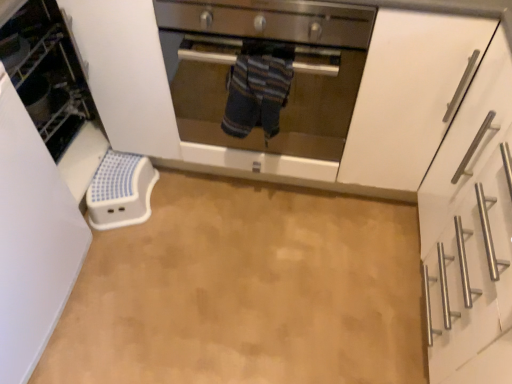
Question: Does white matte cabinet at right have a smaller size compared to stainless steel oven at center?

Choices:
 (A) no
 (B) yes

Answer: (A)

Question: Can you confirm if white matte cabinet at right is positioned to the right of stainless steel oven at center?

Choices:
 (A) yes
 (B) no

Answer: (A)

Question: From the image's perspective, is white matte cabinet at right located above stainless steel oven at center?

Choices:
 (A) yes
 (B) no

Answer: (B)

Question: Considering the relative sizes of white matte cabinet at right and stainless steel oven at center in the image provided, is white matte cabinet at right bigger than stainless steel oven at center?

Choices:
 (A) no
 (B) yes

Answer: (B)

Question: From the image's perspective, is white matte cabinet at right beneath stainless steel oven at center?

Choices:
 (A) no
 (B) yes

Answer: (B)

Question: From a real-world perspective, is stainless steel oven at center physically located above or below white plastic step stool at left?

Choices:
 (A) below
 (B) above

Answer: (B)

Question: Based on their sizes in the image, would you say stainless steel oven at center is bigger or smaller than white plastic step stool at left?

Choices:
 (A) small
 (B) big

Answer: (B)

Question: In terms of height, does stainless steel oven at center look taller or shorter compared to white plastic step stool at left?

Choices:
 (A) short
 (B) tall

Answer: (A)

Question: Relative to white plastic step stool at left, is stainless steel oven at center in front or behind?

Choices:
 (A) behind
 (B) front

Answer: (A)

Question: From a real-world perspective, is white matte cabinet at right physically located above or below stainless steel oven at center?

Choices:
 (A) above
 (B) below

Answer: (B)

Question: Is white matte cabinet at right situated inside stainless steel oven at center or outside?

Choices:
 (A) inside
 (B) outside

Answer: (B)

Question: Considering the positions of white matte cabinet at right and stainless steel oven at center in the image, is white matte cabinet at right wider or thinner than stainless steel oven at center?

Choices:
 (A) wide
 (B) thin

Answer: (A)

Question: Visually, is white matte cabinet at right positioned to the left or to the right of stainless steel oven at center?

Choices:
 (A) left
 (B) right

Answer: (B)

Question: Considering their positions, is white plastic step stool at left located in front of or behind striped fabric towel at center?

Choices:
 (A) front
 (B) behind

Answer: (A)

Question: Considering the positions of white plastic step stool at left and striped fabric towel at center in the image, is white plastic step stool at left bigger or smaller than striped fabric towel at center?

Choices:
 (A) big
 (B) small

Answer: (A)